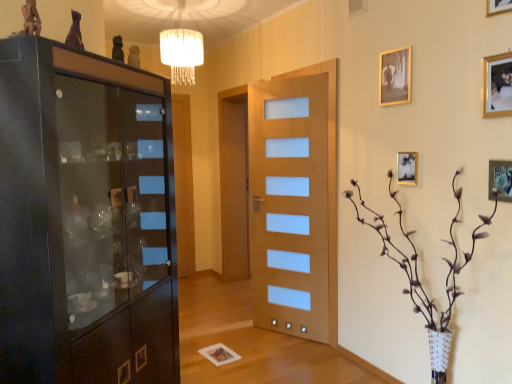
Describe the element at coordinates (75, 32) in the screenshot. I see `matte brown statue at upper left, the second art from the front` at that location.

This screenshot has height=384, width=512. Find the location of `matte gold picture frame at upper right, which appears as the 4th picture frame when ordered from the bottom`. matte gold picture frame at upper right, which appears as the 4th picture frame when ordered from the bottom is located at coordinates (395, 76).

The width and height of the screenshot is (512, 384). Describe the element at coordinates (500, 179) in the screenshot. I see `metallic gold picture frame at upper right, which ranks as the first picture frame in bottom-to-top order` at that location.

What do you see at coordinates (497, 85) in the screenshot?
I see `gold metallic picture frame at upper right, the 3th picture frame positioned from the bottom` at bounding box center [497, 85].

Where is `matte black statue at upper left, which is the 1th art from left to right`? matte black statue at upper left, which is the 1th art from left to right is located at coordinates (31, 18).

What do you see at coordinates (31, 18) in the screenshot? This screenshot has height=384, width=512. I see `matte black statue at upper left, the 2th art from the right` at bounding box center [31, 18].

In order to click on white fabric lampshade at upper center in this screenshot , I will do `click(181, 50)`.

Image resolution: width=512 pixels, height=384 pixels. Find the location of `gold metallic picture frame at upper right, which appears as the 4th picture frame when viewed from the top`. gold metallic picture frame at upper right, which appears as the 4th picture frame when viewed from the top is located at coordinates (407, 168).

Measure the distance between wooden door with frosted glass panels at center and metallic gold picture frame at upper right, which ranks as the first picture frame in bottom-to-top order.

They are 1.56 meters apart.

Which is closer to the camera, (267,215) or (496,187)?

Point (267,215) appears to be farther away from the viewer than point (496,187).

Between wooden door with frosted glass panels at center and metallic gold picture frame at upper right, which ranks as the first picture frame in bottom-to-top order, which one appears on the right side from the viewer's perspective?

From the viewer's perspective, metallic gold picture frame at upper right, which ranks as the first picture frame in bottom-to-top order, appears more on the right side.

Is wooden door with frosted glass panels at center wider or thinner than metallic gold picture frame at upper right, which appears as the fifth picture frame when viewed from the top?

In the image, wooden door with frosted glass panels at center appears to be wider than metallic gold picture frame at upper right, which appears as the fifth picture frame when viewed from the top.

Considering the points (178, 36) and (78, 45), which point is in front, point (178, 36) or point (78, 45)?

Point (78, 45)

From the image's perspective, is white fabric lampshade at upper center located beneath matte brown statue at upper left, arranged as the first art when viewed from the back?

No, from the image's perspective, white fabric lampshade at upper center is not below matte brown statue at upper left, arranged as the first art when viewed from the back.

Could you tell me if white fabric lampshade at upper center is turned towards matte brown statue at upper left, arranged as the first art when viewed from the back?

No, white fabric lampshade at upper center is not aimed at matte brown statue at upper left, arranged as the first art when viewed from the back.

From a real-world perspective, is white fabric lampshade at upper center above or below matte brown statue at upper left, placed as the 1th art when sorted from right to left?

white fabric lampshade at upper center is above matte brown statue at upper left, placed as the 1th art when sorted from right to left.

Based on the photo, how different are the orientations of gold metallic picture frame at upper right, the 2th picture frame from the bottom, and matte brown statue at upper left, arranged as the first art when viewed from the back, in degrees?

gold metallic picture frame at upper right, the 2th picture frame from the bottom, and matte brown statue at upper left, arranged as the first art when viewed from the back, are facing 133 degrees away from each other.

Is gold metallic picture frame at upper right, which appears as the 4th picture frame when viewed from the top, positioned behind matte brown statue at upper left, the 2th art positioned from the left?

Yes, it is behind matte brown statue at upper left, the 2th art positioned from the left.

Considering the sizes of gold metallic picture frame at upper right, the 2th picture frame from the bottom, and matte brown statue at upper left, placed as the 1th art when sorted from right to left, in the image, is gold metallic picture frame at upper right, the 2th picture frame from the bottom, wider or thinner than matte brown statue at upper left, placed as the 1th art when sorted from right to left,?

Clearly, gold metallic picture frame at upper right, the 2th picture frame from the bottom, has less width compared to matte brown statue at upper left, placed as the 1th art when sorted from right to left.

Considering the sizes of objects gold metallic picture frame at upper right, the 2th picture frame from the bottom, and matte brown statue at upper left, arranged as the first art when viewed from the back, in the image provided, who is shorter, gold metallic picture frame at upper right, the 2th picture frame from the bottom, or matte brown statue at upper left, arranged as the first art when viewed from the back,?

gold metallic picture frame at upper right, the 2th picture frame from the bottom.

Considering their positions, is matte black cabinet at left located in front of or behind matte black statue at upper left, placed as the first art when sorted from front to back?

Clearly, matte black cabinet at left is in front of matte black statue at upper left, placed as the first art when sorted from front to back.

From a real-world perspective, is matte black cabinet at left positioned under matte black statue at upper left, placed as the first art when sorted from front to back, based on gravity?

→ Yes, from a real-world perspective, matte black cabinet at left is beneath matte black statue at upper left, placed as the first art when sorted from front to back.

Considering the relative sizes of matte black cabinet at left and matte black statue at upper left, which is counted as the 2th art, starting from the back, in the image provided, is matte black cabinet at left wider than matte black statue at upper left, which is counted as the 2th art, starting from the back,?

Correct, the width of matte black cabinet at left exceeds that of matte black statue at upper left, which is counted as the 2th art, starting from the back.

Could you measure the distance between matte black cabinet at left and matte black statue at upper left, which is counted as the 2th art, starting from the back?

39.01 inches.

Is the depth of matte gold picture frame at upper right, which appears as the 4th picture frame when ordered from the bottom, less than that of gold metallic picture frame at upper right, the 5th picture frame in the bottom-to-top sequence?

No, matte gold picture frame at upper right, which appears as the 4th picture frame when ordered from the bottom, is behind gold metallic picture frame at upper right, the 5th picture frame in the bottom-to-top sequence.

Can you tell me how much matte gold picture frame at upper right, which appears as the 4th picture frame when ordered from the bottom, and gold metallic picture frame at upper right, the 5th picture frame in the bottom-to-top sequence, differ in facing direction?

The facing directions of matte gold picture frame at upper right, which appears as the 4th picture frame when ordered from the bottom, and gold metallic picture frame at upper right, the 5th picture frame in the bottom-to-top sequence, are 0.00405 degrees apart.

Considering the sizes of matte gold picture frame at upper right, which appears as the 4th picture frame when ordered from the bottom, and gold metallic picture frame at upper right, the 5th picture frame in the bottom-to-top sequence, in the image, is matte gold picture frame at upper right, which appears as the 4th picture frame when ordered from the bottom, bigger or smaller than gold metallic picture frame at upper right, the 5th picture frame in the bottom-to-top sequence,?

In the image, matte gold picture frame at upper right, which appears as the 4th picture frame when ordered from the bottom, appears to be larger than gold metallic picture frame at upper right, the 5th picture frame in the bottom-to-top sequence.

Considering the sizes of objects matte gold picture frame at upper right, which is counted as the second picture frame, starting from the top, and gold metallic picture frame at upper right, which is counted as the first picture frame, starting from the top, in the image provided, who is wider, matte gold picture frame at upper right, which is counted as the second picture frame, starting from the top, or gold metallic picture frame at upper right, which is counted as the first picture frame, starting from the top,?

matte gold picture frame at upper right, which is counted as the second picture frame, starting from the top, is wider.

Does matte black cabinet at left have a larger size compared to gold metallic picture frame at upper right, the 2th picture frame from the bottom?

Yes.

Is matte black cabinet at left closer to camera compared to gold metallic picture frame at upper right, which appears as the 4th picture frame when viewed from the top?

Yes, matte black cabinet at left is closer to the camera.

Can you confirm if matte black cabinet at left is thinner than gold metallic picture frame at upper right, the 2th picture frame from the bottom?

No.

Between point (435, 309) and point (175, 29), which one is positioned in front?

The point (435, 309) is closer to the camera.

Is brown textured vase at right turned away from white fabric lampshade at upper center?

No, white fabric lampshade at upper center is not at the back of brown textured vase at right.

Considering the relative positions of brown textured vase at right and white fabric lampshade at upper center in the image provided, is brown textured vase at right to the right of white fabric lampshade at upper center from the viewer's perspective?

Indeed, brown textured vase at right is positioned on the right side of white fabric lampshade at upper center.

From a real-world perspective, which is physically above, brown textured vase at right or white fabric lampshade at upper center?

In real-world perspective, white fabric lampshade at upper center is above.

Locate an element on the screen. The height and width of the screenshot is (384, 512). door that appears behind the metallic gold picture frame at upper right, which ranks as the first picture frame in bottom-to-top order is located at coordinates 290,205.

This screenshot has width=512, height=384. Find the location of `lamp above the matte brown statue at upper left, the second art from the front (from a real-world perspective)`. lamp above the matte brown statue at upper left, the second art from the front (from a real-world perspective) is located at coordinates (181, 50).

Consider the image. Based on their spatial positions, is gold metallic picture frame at upper right, which is counted as the first picture frame, starting from the top, or white fabric lampshade at upper center closer to brown textured vase at right?

gold metallic picture frame at upper right, which is counted as the first picture frame, starting from the top, lies closer to brown textured vase at right than the other object.

Considering their positions, is gold metallic picture frame at upper right, which is counted as the first picture frame, starting from the top, positioned closer to matte black cabinet at left than white fabric lampshade at upper center?

white fabric lampshade at upper center is closer to matte black cabinet at left.

Which object lies nearer to the anchor point white fabric lampshade at upper center, matte black cabinet at left or matte gold picture frame at upper right, which is counted as the second picture frame, starting from the top?

matte black cabinet at left.

From the image, which object appears to be farther from matte gold picture frame at upper right, which appears as the 4th picture frame when ordered from the bottom, gold metallic picture frame at upper right, which is counted as the first picture frame, starting from the top, or brown textured vase at right?

brown textured vase at right.

Based on their spatial positions, is matte black cabinet at left or gold metallic picture frame at upper right, the 5th picture frame in the bottom-to-top sequence, further from gold metallic picture frame at upper right, the 2th picture frame from the bottom?

matte black cabinet at left is further to gold metallic picture frame at upper right, the 2th picture frame from the bottom.

Which object lies nearer to the anchor point matte brown statue at upper left, arranged as the first art when viewed from the back, metallic gold picture frame at upper right, which appears as the fifth picture frame when viewed from the top, or gold metallic picture frame at upper right, the 2th picture frame from the bottom?

Among the two, gold metallic picture frame at upper right, the 2th picture frame from the bottom, is located nearer to matte brown statue at upper left, arranged as the first art when viewed from the back.

From the image, which object appears to be farther from gold metallic picture frame at upper right, the 5th picture frame in the bottom-to-top sequence, brown textured vase at right or gold metallic picture frame at upper right, the 3th picture frame positioned from the bottom?

The object further to gold metallic picture frame at upper right, the 5th picture frame in the bottom-to-top sequence, is brown textured vase at right.

Looking at the image, which one is located closer to matte gold picture frame at upper right, which is counted as the second picture frame, starting from the top, matte brown statue at upper left, the 2th art positioned from the left, or white fabric lampshade at upper center?

white fabric lampshade at upper center is positioned closer to the anchor matte gold picture frame at upper right, which is counted as the second picture frame, starting from the top.

Locate an element on the screen. The height and width of the screenshot is (384, 512). floral arrangement between white fabric lampshade at upper center and gold metallic picture frame at upper right, the 3th picture frame positioned from the bottom is located at coordinates (x=417, y=255).

You are a GUI agent. You are given a task and a screenshot of the screen. Output one action in this format:
    pyautogui.click(x=<x>, y=<y>)
    Task: Click on the lamp between matte brown statue at upper left, arranged as the first art when viewed from the back, and gold metallic picture frame at upper right, the 2th picture frame from the bottom, from left to right
    The width and height of the screenshot is (512, 384).
    Given the screenshot: What is the action you would take?
    pyautogui.click(x=181, y=50)

What are the coordinates of `cupboard situated between matte black statue at upper left, which is counted as the 2th art, starting from the back, and brown textured vase at right from left to right` in the screenshot? It's located at (85, 219).

You are a GUI agent. You are given a task and a screenshot of the screen. Output one action in this format:
    pyautogui.click(x=<x>, y=<y>)
    Task: Click on the cupboard situated between matte black statue at upper left, which is the 1th art from left to right, and gold metallic picture frame at upper right, which appears as the 4th picture frame when viewed from the top, from left to right
    The width and height of the screenshot is (512, 384).
    Given the screenshot: What is the action you would take?
    pyautogui.click(x=85, y=219)